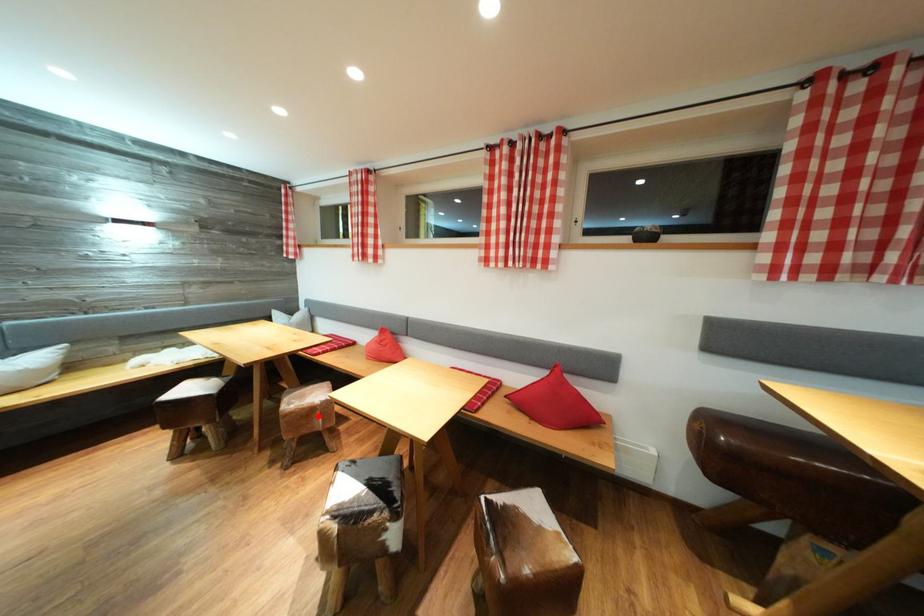
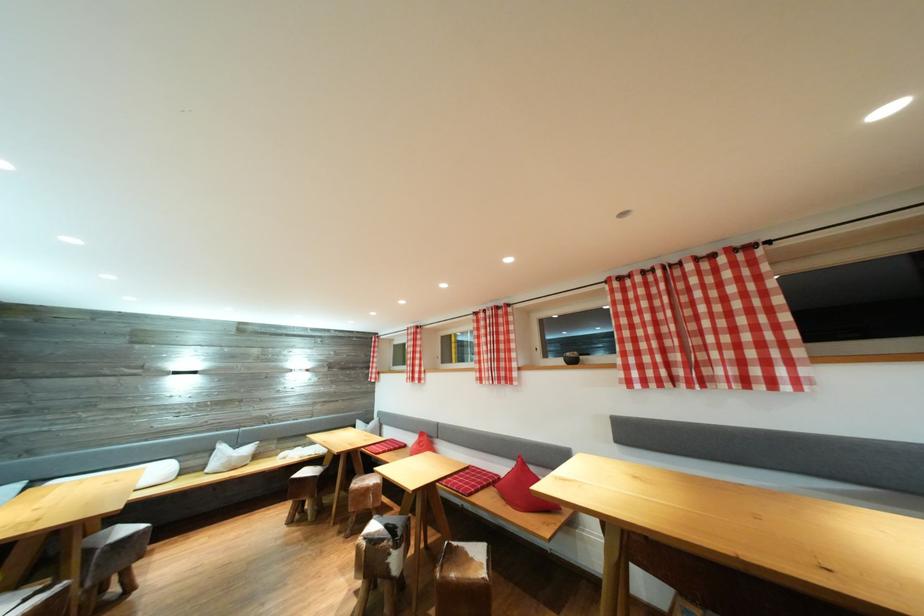
Question: I am providing you with two images of the same scene from different viewpoints. A red point is marked on the first image. Can you still see the location of the red point in image 2?

Choices:
 (A) Yes
 (B) No

Answer: (A)